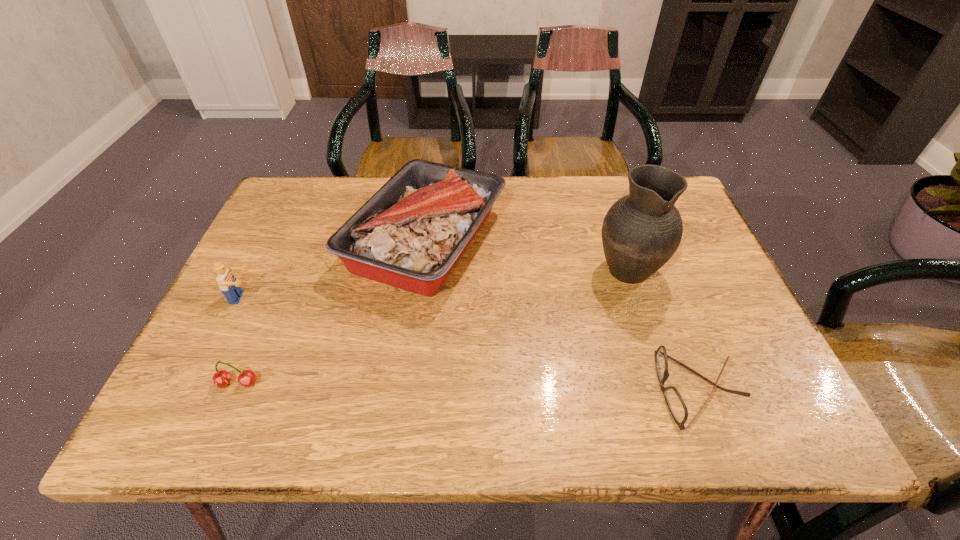
You are a GUI agent. You are given a task and a screenshot of the screen. Output one action in this format:
    pyautogui.click(x=<x>, y=<y>)
    Task: Click on the blank space located on the face of the Lego
    The height and width of the screenshot is (540, 960).
    Given the screenshot: What is the action you would take?
    pyautogui.click(x=395, y=298)

What are the coordinates of `vacant space located on the front-facing side of the shortest object` in the screenshot? It's located at (618, 389).

Locate an element on the screen. This screenshot has height=540, width=960. free location located on the front-facing side of the shortest object is located at coordinates [473, 389].

Locate an element on the screen. This screenshot has width=960, height=540. vacant area located 0.230m on the front-facing side of the shortest object is located at coordinates (540, 389).

Where is `object at the far edge`? object at the far edge is located at coordinates (410, 234).

Locate an element on the screen. object at the near edge is located at coordinates (677, 407).

The image size is (960, 540). I want to click on Lego that is at the left edge, so click(229, 286).

This screenshot has width=960, height=540. I want to click on cherry positioned at the left edge, so pos(246,378).

Image resolution: width=960 pixels, height=540 pixels. Find the location of `pitcher present at the right edge`. pitcher present at the right edge is located at coordinates (x=641, y=231).

The height and width of the screenshot is (540, 960). In order to click on spectacles that is at the right edge in this screenshot , I will do `click(677, 407)`.